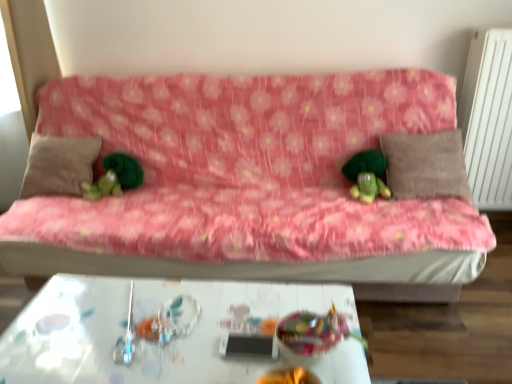
Find the location of a particular element. vacant space that is to the left of translucent plastic bowl at center, the 1th toy when ordered from front to back is located at coordinates (230, 345).